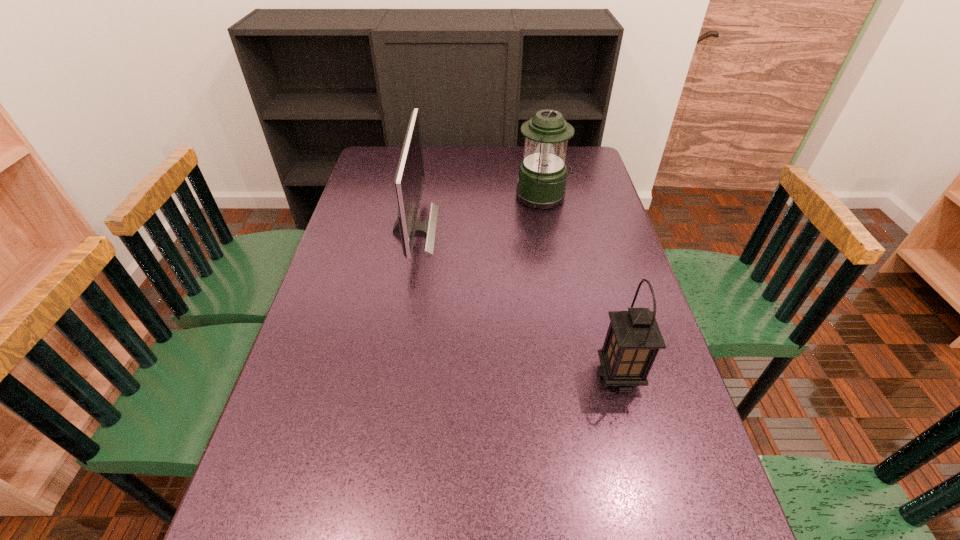
Identify which object is located as the nearest to the farther lantern. Please provide its 2D coordinates. Your answer should be formatted as a tuple, i.e. [(x, y)], where the tuple contains the x and y coordinates of a point satisfying the conditions above.

[(409, 180)]

The width and height of the screenshot is (960, 540). I want to click on the closest object to the nearer lantern, so click(409, 180).

Locate an element on the screen. vacant space that satisfies the following two spatial constraints: 1. on the front side of the nearest object; 2. on the right side of the farther lantern is located at coordinates (575, 376).

I want to click on vacant point that satisfies the following two spatial constraints: 1. on the front side of the farther lantern; 2. on the screen side of the leftmost object, so click(x=549, y=230).

Find the location of `vacant region that satisfies the following two spatial constraints: 1. on the screen side of the nearest object; 2. on the right side of the monitor`. vacant region that satisfies the following two spatial constraints: 1. on the screen side of the nearest object; 2. on the right side of the monitor is located at coordinates (390, 376).

Locate an element on the screen. This screenshot has height=540, width=960. free spot that satisfies the following two spatial constraints: 1. on the back side of the nearest object; 2. on the screen side of the monitor is located at coordinates (580, 230).

Identify the location of vacant space that satisfies the following two spatial constraints: 1. on the front side of the farther lantern; 2. on the screen side of the monitor. (549, 230).

The width and height of the screenshot is (960, 540). I want to click on free spot that satisfies the following two spatial constraints: 1. on the screen side of the nearest object; 2. on the right side of the leftmost object, so click(390, 376).

Find the location of a particular element. The image size is (960, 540). vacant region that satisfies the following two spatial constraints: 1. on the screen side of the monitor; 2. on the right side of the nearer lantern is located at coordinates (390, 376).